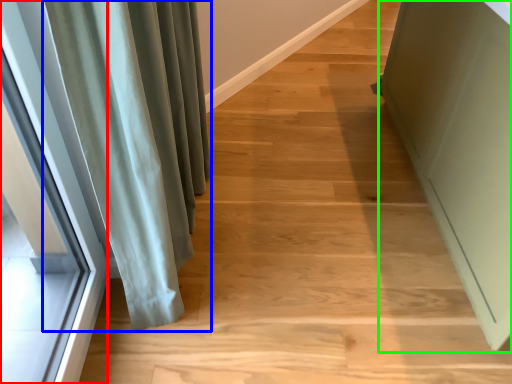
Question: Considering the real-world distances, which object is farthest from window (highlighted by a red box)? curtain (highlighted by a blue box) or screen door (highlighted by a green box)?

Choices:
 (A) curtain
 (B) screen door

Answer: (B)